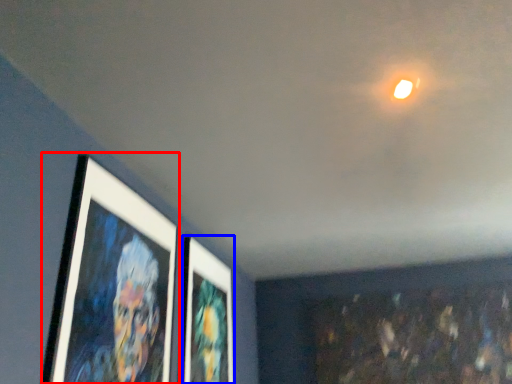
Question: Which object is further to the camera taking this photo, picture frame (highlighted by a red box) or picture frame (highlighted by a blue box)?

Choices:
 (A) picture frame
 (B) picture frame

Answer: (B)